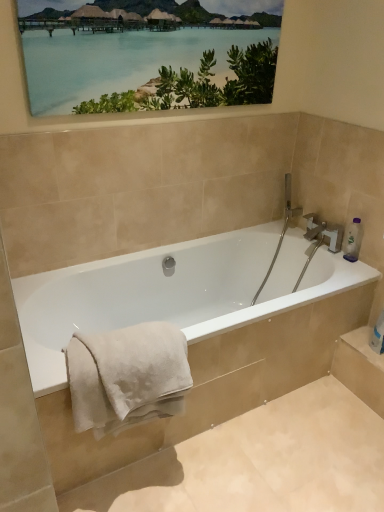
At what (x,y) coordinates should I click in order to perform the action: click on free spot to the left of clear plastic bottle at upper right. Please return your answer as a coordinate pair (x, y). Looking at the image, I should click on (332, 251).